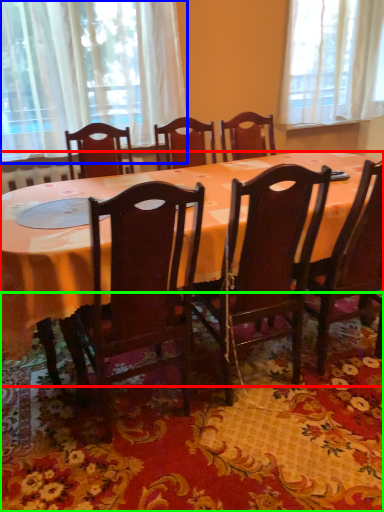
Question: Based on their relative distances, which object is farther from desk (highlighted by a red box)? Choose from curtain (highlighted by a blue box) and mat (highlighted by a green box).

Choices:
 (A) curtain
 (B) mat

Answer: (A)